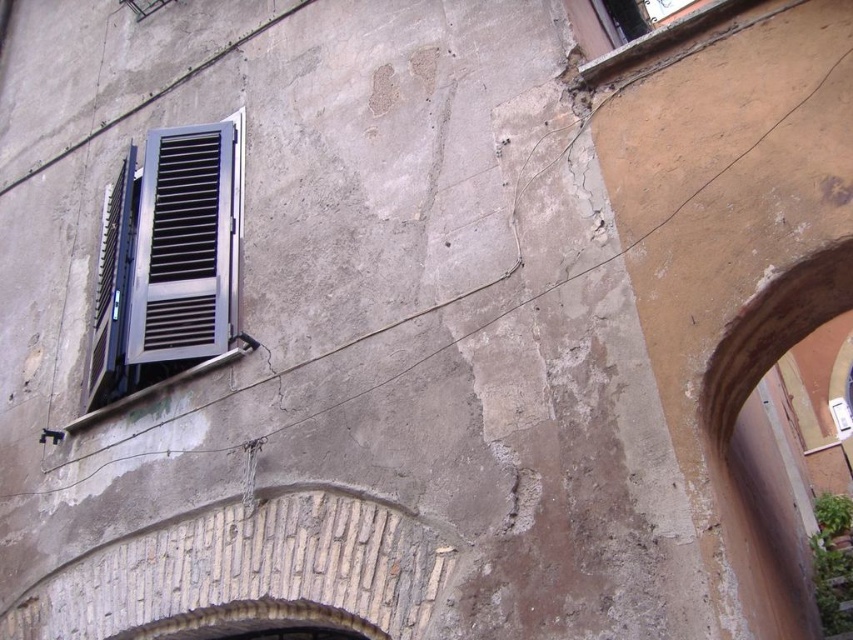
You are an architect examining the old building. You notice the metallic silver shutter at left and the smooth stone archway at center. Which object is positioned farther away from the viewer?

The smooth stone archway at center is positioned farther away from the viewer than the metallic silver shutter at left because it is located behind the shutter.

You are an architect examining the old building. You notice the metallic gray window at left and the smooth stone archway at center. Which structure has a larger vertical dimension?

The metallic gray window at left has a greater height compared to the smooth stone archway at center, so the metallic gray window at left has a larger vertical dimension.

You are an architect assessing the structural integrity of the old building. You notice the metallic gray window at left and the metallic silver shutter at left. Which object has a greater width when viewed from the front?

The metallic gray window at left might be wider than the metallic silver shutter at left, so the window could have a greater width when viewed from the front.